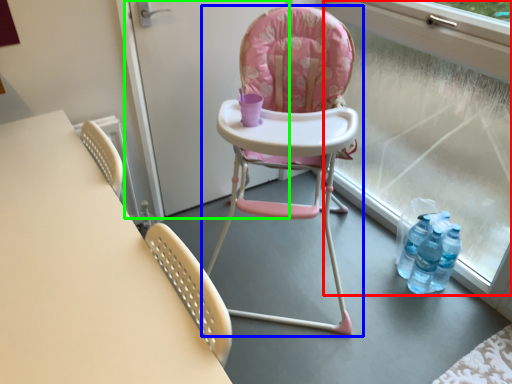
Question: Estimate the real-world distances between objects in this image. Which object is closer to window frame (highlighted by a red box), chair (highlighted by a blue box) or screen door (highlighted by a green box)?

Choices:
 (A) chair
 (B) screen door

Answer: (A)